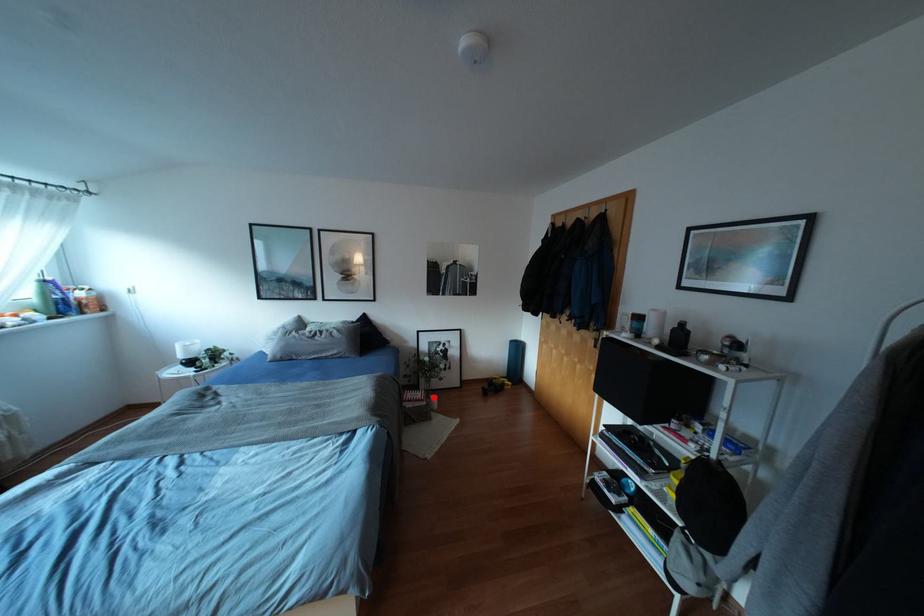
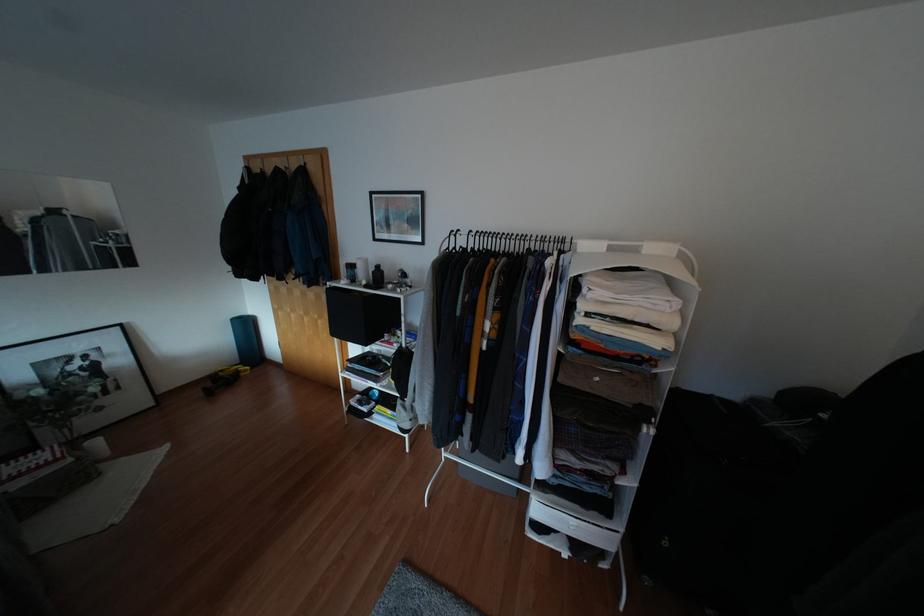
Where in the second image is the point corresponding to the highlighted location from the first image?

(94, 442)